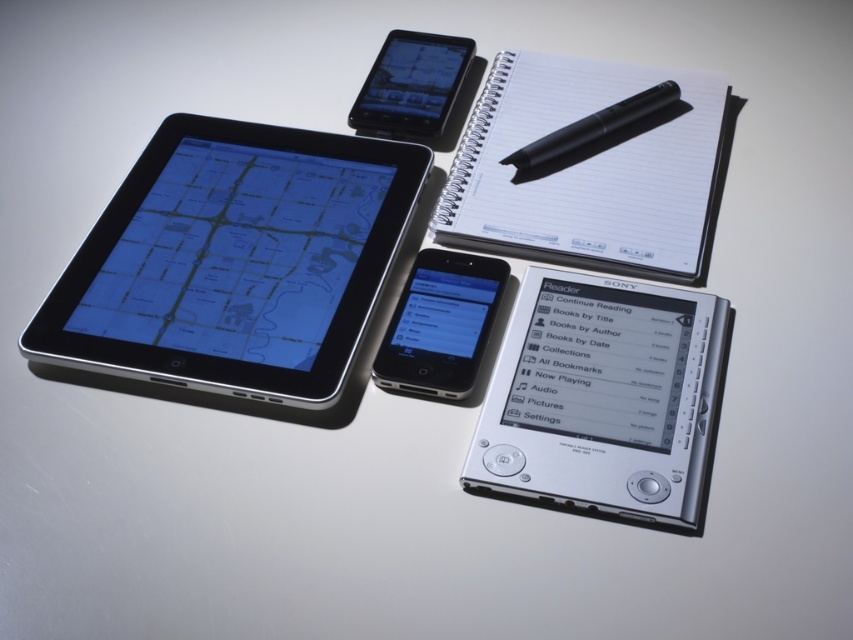
Question: Estimate the real-world distances between objects in this image. Which object is farther from the white paper notebook at upper right?

Choices:
 (A) black glossy ipod at center
 (B) silver metallic tablet at center-left
 (C) black matte pen at upper center

Answer: (B)

Question: Can you confirm if silver metallic tablet at center-left is thinner than matte black tablet at upper center?

Choices:
 (A) yes
 (B) no

Answer: (B)

Question: Which object is closer to the camera taking this photo?

Choices:
 (A) silver metallic e-reader at center
 (B) silver metallic tablet at center-left
 (C) matte black tablet at upper center
 (D) black glossy ipod at center

Answer: (A)

Question: Which object is farther from the camera taking this photo?

Choices:
 (A) silver metallic e-reader at center
 (B) white paper notebook at upper right
 (C) black matte pen at upper center

Answer: (C)

Question: Can you confirm if silver metallic tablet at center-left is positioned above black glossy ipod at center?

Choices:
 (A) no
 (B) yes

Answer: (B)

Question: From the image, what is the correct spatial relationship of silver metallic tablet at center-left in relation to black glossy ipod at center?

Choices:
 (A) right
 (B) left

Answer: (B)